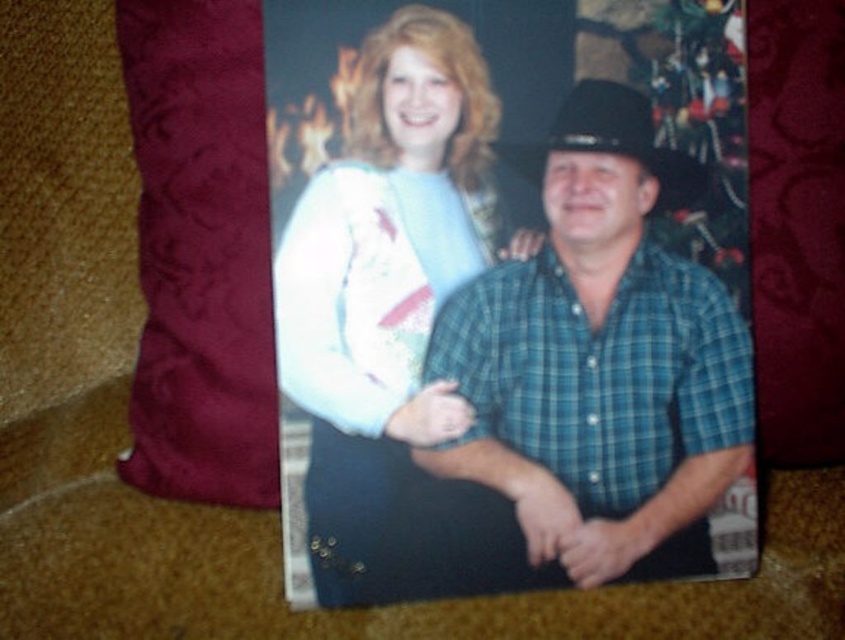
Is blue plaid shirt at center smaller than velvet-like burgundy throw pillow at left?

Yes.

Which is above, blue plaid shirt at center or velvet-like burgundy throw pillow at left?

velvet-like burgundy throw pillow at left is higher up.

The image size is (845, 640). What are the coordinates of `blue plaid shirt at center` in the screenshot? It's located at (597, 360).

The width and height of the screenshot is (845, 640). I want to click on blue plaid shirt at center, so click(x=597, y=360).

Who is positioned more to the right, blue plaid shirt at center or black felt cowboy hat at center?

From the viewer's perspective, black felt cowboy hat at center appears more on the right side.

Which is behind, point (581, 573) or point (608, 90)?

The point (581, 573) is more distant.

Which is behind, point (630, 438) or point (698, 195)?

Positioned behind is point (698, 195).

Locate an element on the screen. The width and height of the screenshot is (845, 640). blue plaid shirt at center is located at coordinates (597, 360).

Can you confirm if velvet-like burgundy throw pillow at left is positioned above black felt cowboy hat at center?

No.

Can you confirm if velvet-like burgundy throw pillow at left is taller than black felt cowboy hat at center?

Yes.

Between point (178, 433) and point (615, 99), which one is positioned behind?

Point (178, 433)

Where is `velvet-like burgundy throw pillow at left`? This screenshot has height=640, width=845. velvet-like burgundy throw pillow at left is located at coordinates (200, 253).